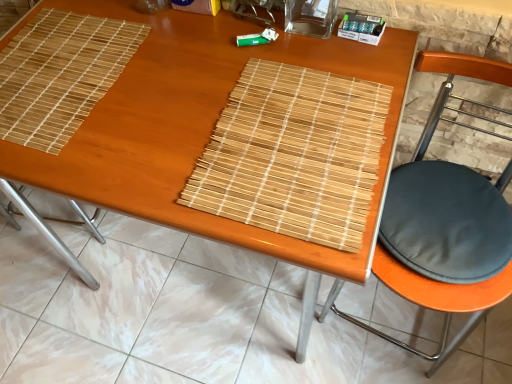
I want to click on free space above natural wood mat at upper left, which is counted as the 1th mat, starting from the left (from a real-world perspective), so click(53, 66).